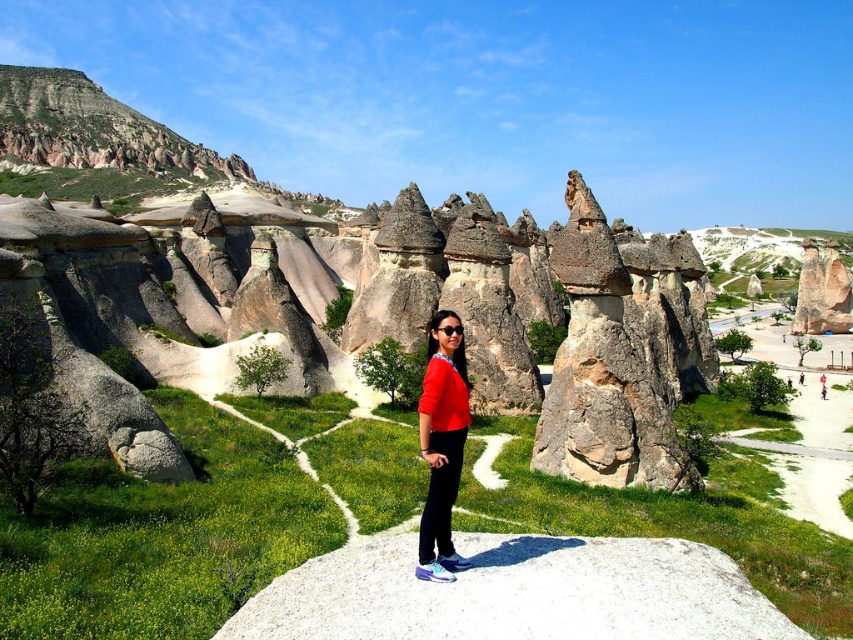
You are a photographer trying to capture the rustic stone rock formation at center in your shot. You want to ensure that the formation is centered in the frame. Given that the camera sensor has a resolution of 1920x1080 pixels, and the formation is located at coordinates point 0.495, 0.471, will the formation be perfectly centered in your image? Explain your reasoning.

The rustic stone rock formation at center is located at coordinates point (401, 316). Since the center of the image would be at coordinates (426, 320), the formation is very close to the center but slightly offset to the left and down. Therefore, it is not perfectly centered.

You are a photographer standing in front of the rustic stone rock formation at center and the red matte sweater at center. Which object is closer to you?

The rustic stone rock formation at center is closer to you than the red matte sweater at center.